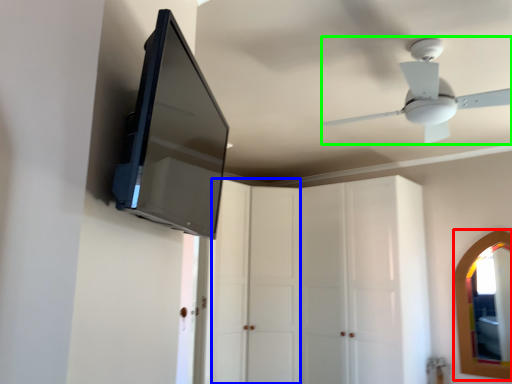
Question: Which object is the farthest from mirror (highlighted by a red box)? Choose among these: glass door (highlighted by a blue box) or ceiling fan (highlighted by a green box).

Choices:
 (A) glass door
 (B) ceiling fan

Answer: (B)